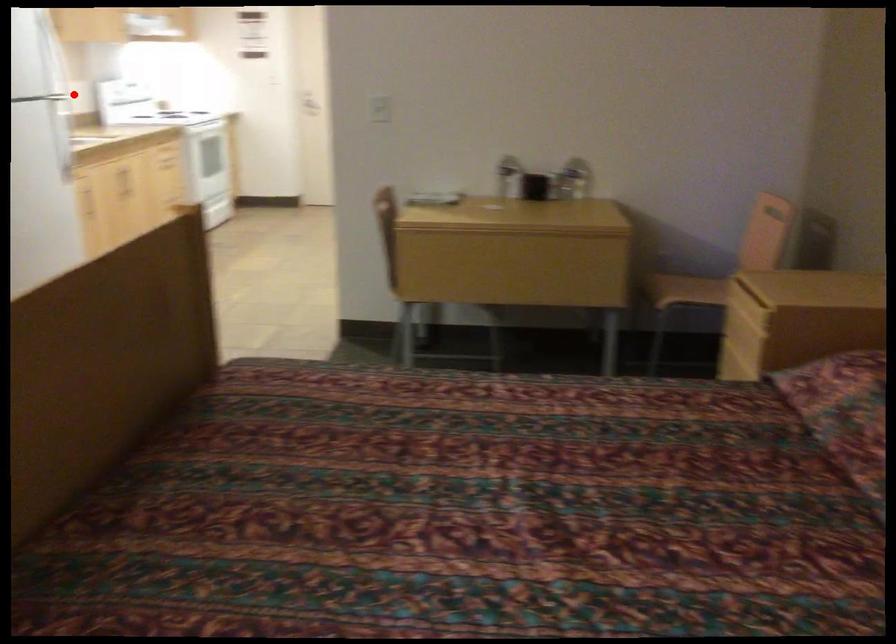
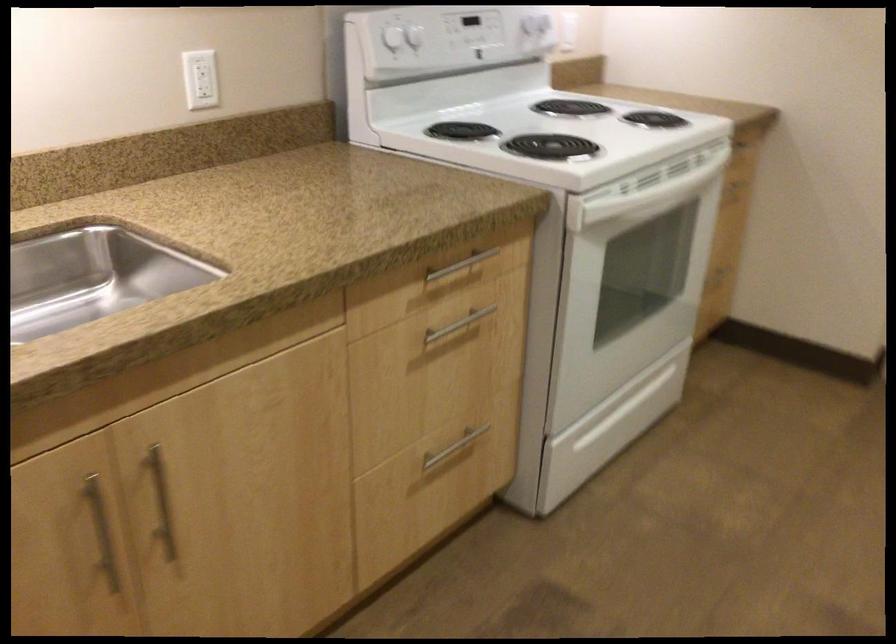
Where in the second image is the point corresponding to the highlighted location from the first image?

(200, 79)